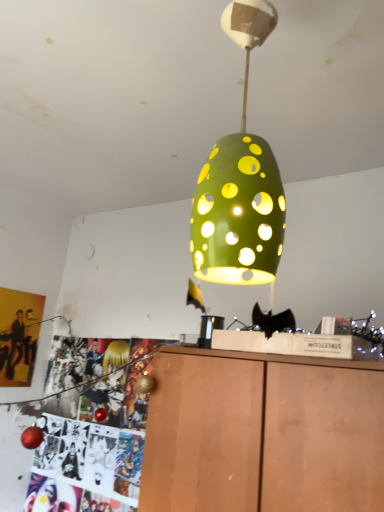
Describe the element at coordinates (240, 183) in the screenshot. The height and width of the screenshot is (512, 384). I see `green matte/porcelain lamp at center` at that location.

Describe the element at coordinates (19, 335) in the screenshot. This screenshot has height=512, width=384. I see `matte yellow poster at left` at that location.

Where is `wooden cabinet at lower center`? wooden cabinet at lower center is located at coordinates (263, 433).

Find the location of `green matte/porcelain lamp at center`. green matte/porcelain lamp at center is located at coordinates (240, 183).

How many degrees apart are the facing directions of green matte/porcelain lamp at center and matte yellow poster at left?

The angular difference between green matte/porcelain lamp at center and matte yellow poster at left is 88.7 degrees.

Is green matte/porcelain lamp at center taller than matte yellow poster at left?

Yes.

Which of these two, green matte/porcelain lamp at center or matte yellow poster at left, is smaller?

matte yellow poster at left.

Which object is more forward, green matte/porcelain lamp at center or matte yellow poster at left?

green matte/porcelain lamp at center is closer to the camera.

Between point (37, 304) and point (206, 459), which one is positioned behind?

Positioned behind is point (37, 304).

Looking at this image, from a real-world perspective, is matte yellow poster at left under wooden cabinet at lower center?

Incorrect, from a real-world perspective, matte yellow poster at left is higher than wooden cabinet at lower center.

Is matte yellow poster at left wider or thinner than wooden cabinet at lower center?

Clearly, matte yellow poster at left has less width compared to wooden cabinet at lower center.

Consider the image. Which is in front, matte yellow poster at left or wooden cabinet at lower center?

Positioned in front is wooden cabinet at lower center.

Is wooden cabinet at lower center smaller than matte yellow poster at left?

Incorrect, wooden cabinet at lower center is not smaller in size than matte yellow poster at left.

In terms of height, does wooden cabinet at lower center look taller or shorter compared to matte yellow poster at left?

In the image, wooden cabinet at lower center appears to be taller than matte yellow poster at left.

Is wooden cabinet at lower center situated inside matte yellow poster at left or outside?

wooden cabinet at lower center is not inside matte yellow poster at left, it's outside.

Is wooden cabinet at lower center further to camera compared to matte yellow poster at left?

No.

Which is closer to the camera, [238,206] or [325,503]?

The point [238,206] is more forward.

Which is more to the right, green matte/porcelain lamp at center or wooden cabinet at lower center?

Positioned to the right is wooden cabinet at lower center.

Who is bigger, green matte/porcelain lamp at center or wooden cabinet at lower center?

Bigger between the two is wooden cabinet at lower center.

Considering the relative sizes of matte yellow poster at left and green matte/porcelain lamp at center in the image provided, is matte yellow poster at left taller than green matte/porcelain lamp at center?

No, matte yellow poster at left is not taller than green matte/porcelain lamp at center.

Based on the photo, which point is more distant from viewer, (6, 380) or (254, 209)?

Positioned behind is point (6, 380).

Which is more to the right, matte yellow poster at left or green matte/porcelain lamp at center?

Positioned to the right is green matte/porcelain lamp at center.

How much distance is there between matte yellow poster at left and green matte/porcelain lamp at center?

The distance of matte yellow poster at left from green matte/porcelain lamp at center is 6.41 feet.

Which is further, (x=366, y=465) or (x=226, y=167)?

The point (x=366, y=465) is more distant.

Between wooden cabinet at lower center and green matte/porcelain lamp at center, which one has larger size?

wooden cabinet at lower center.

Is there a large distance between wooden cabinet at lower center and green matte/porcelain lamp at center?

No, wooden cabinet at lower center is not far from green matte/porcelain lamp at center.

Does wooden cabinet at lower center lie in front of green matte/porcelain lamp at center?

No.

Where is `lamp in front of the matte yellow poster at left`? lamp in front of the matte yellow poster at left is located at coordinates (240, 183).

Image resolution: width=384 pixels, height=512 pixels. What are the coordinates of `poster page above the wooden cabinet at lower center (from a real-world perspective)` in the screenshot? It's located at [19, 335].

Considering their positions, is matte yellow poster at left positioned further to wooden cabinet at lower center than green matte/porcelain lamp at center?

The object further to wooden cabinet at lower center is matte yellow poster at left.

Looking at the image, which one is located closer to green matte/porcelain lamp at center, wooden cabinet at lower center or matte yellow poster at left?

wooden cabinet at lower center is closer to green matte/porcelain lamp at center.

From the image, which object appears to be nearer to matte yellow poster at left, green matte/porcelain lamp at center or wooden cabinet at lower center?

Based on the image, wooden cabinet at lower center appears to be nearer to matte yellow poster at left.

Which object lies nearer to the anchor point green matte/porcelain lamp at center, matte yellow poster at left or wooden cabinet at lower center?

Based on the image, wooden cabinet at lower center appears to be nearer to green matte/porcelain lamp at center.

From the image, which object appears to be nearer to matte yellow poster at left, wooden cabinet at lower center or green matte/porcelain lamp at center?

wooden cabinet at lower center is closer to matte yellow poster at left.

Based on their spatial positions, is green matte/porcelain lamp at center or matte yellow poster at left further from wooden cabinet at lower center?

matte yellow poster at left.

In order to click on furniture between green matte/porcelain lamp at center and matte yellow poster at left in the front-back direction in this screenshot , I will do `click(263, 433)`.